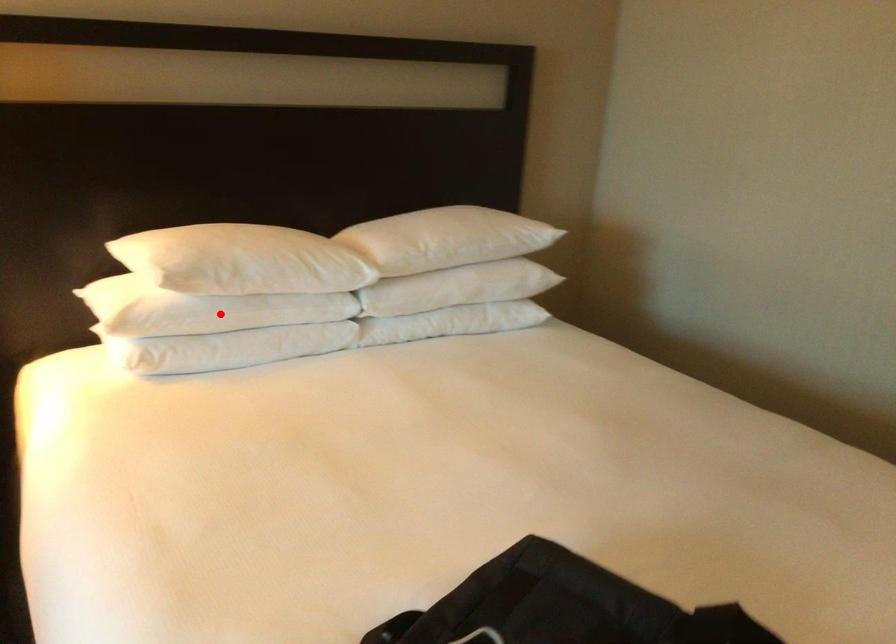
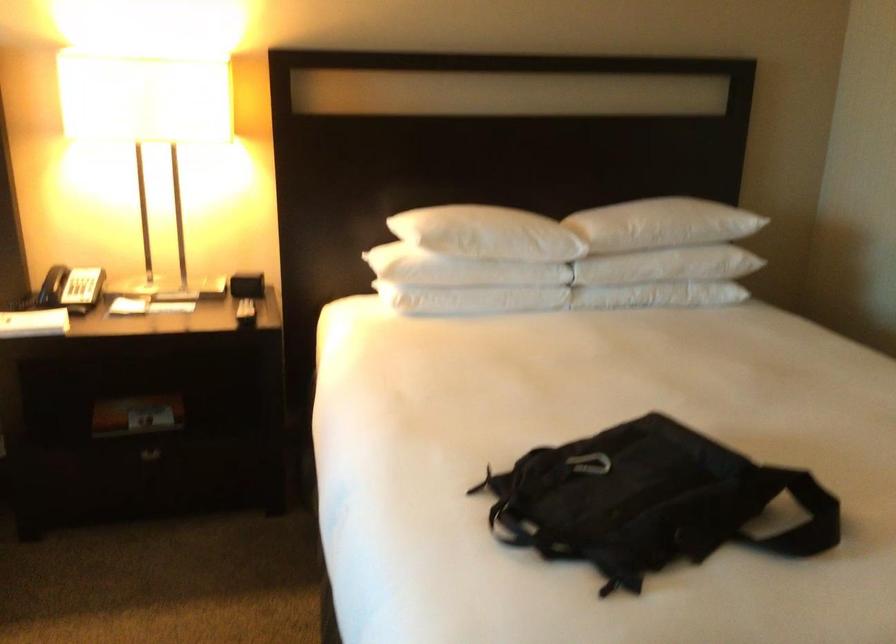
Question: I am providing you with two images of the same scene from different viewpoints. In image1, a red point is highlighted. Considering the same 3D point in image2, which of the following is correct?

Choices:
 (A) It is closer
 (B) It is farther

Answer: (B)